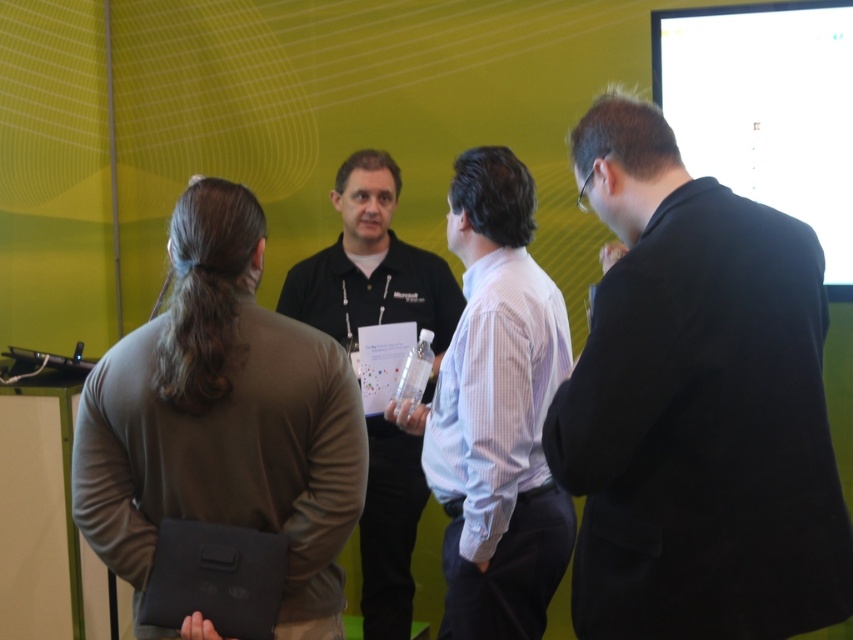
Between point (410, 419) and point (778, 141), which one is positioned behind?

The point (778, 141) is more distant.

Who is more forward, (x=434, y=468) or (x=810, y=84)?

Positioned in front is point (x=434, y=468).

This screenshot has width=853, height=640. Identify the location of white striped shirt at center. (496, 412).

Does point (747, 552) come behind point (453, 592)?

No.

Can you confirm if black suit at right is positioned below white striped shirt at center?

Incorrect, black suit at right is not positioned below white striped shirt at center.

This screenshot has height=640, width=853. What do you see at coordinates (695, 406) in the screenshot? I see `black suit at right` at bounding box center [695, 406].

Image resolution: width=853 pixels, height=640 pixels. I want to click on black suit at right, so click(695, 406).

In the scene shown: Which is above, brown matte laptop at left or white striped shirt at center?

Positioned higher is white striped shirt at center.

In the scene shown: Which is more to the left, brown matte laptop at left or white striped shirt at center?

brown matte laptop at left

Which is in front, point (341, 525) or point (505, 440)?

Point (341, 525) is more forward.

Where is `brown matte laptop at left`? This screenshot has height=640, width=853. brown matte laptop at left is located at coordinates (223, 419).